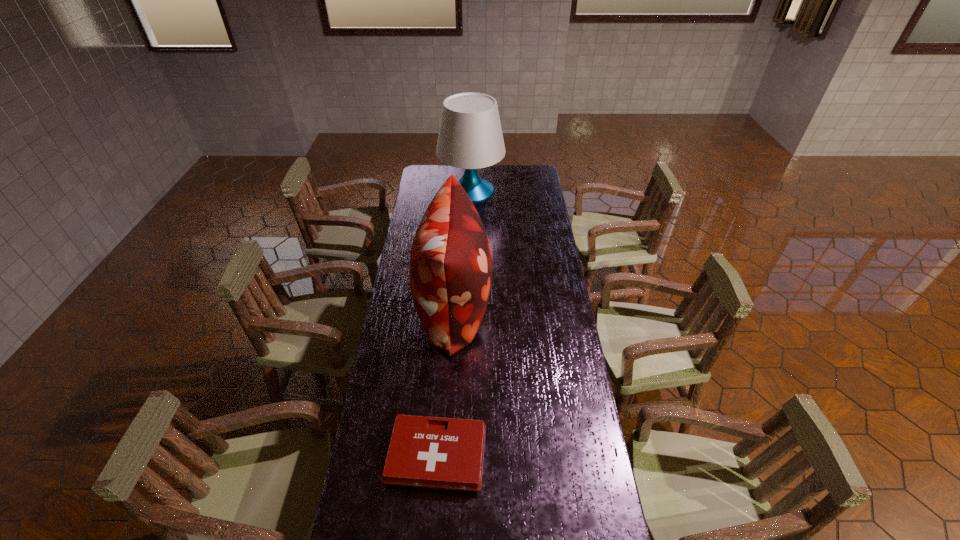
The image size is (960, 540). I want to click on the farthest object, so click(470, 136).

What are the coordinates of `the second nearest object` in the screenshot? It's located at (450, 269).

The width and height of the screenshot is (960, 540). Identify the location of the first-aid kit. (433, 452).

Identify the location of the shortest object. (433, 452).

Locate an element on the screen. vacant space located on the front-facing side of the farthest object is located at coordinates tap(533, 190).

The image size is (960, 540). I want to click on vacant region located on the front-facing side of the second nearest object, so click(x=513, y=308).

In order to click on free space located 0.130m on the right of the shortest object in this screenshot , I will do `click(528, 455)`.

You are a GUI agent. You are given a task and a screenshot of the screen. Output one action in this format:
    pyautogui.click(x=<x>, y=<y>)
    Task: Click on the object positioned at the far edge
    
    Given the screenshot: What is the action you would take?
    pyautogui.click(x=470, y=136)

Where is `table lamp that is at the left edge`? The image size is (960, 540). table lamp that is at the left edge is located at coordinates (470, 136).

The height and width of the screenshot is (540, 960). What are the coordinates of `cushion that is positioned at the left edge` in the screenshot? It's located at 450,269.